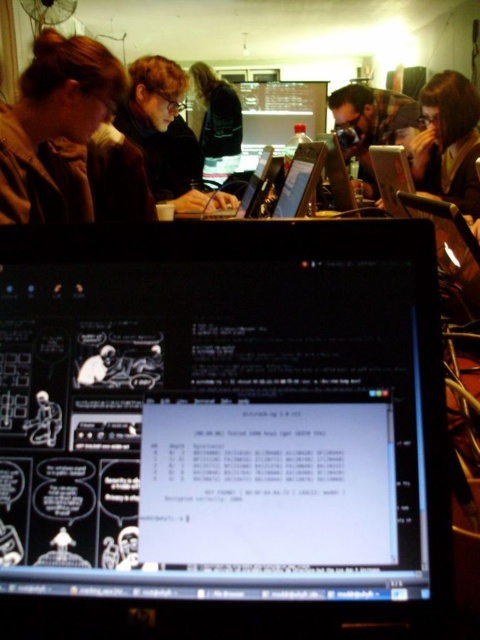
Which is behind, point (154, 125) or point (235, 204)?

The point (154, 125) is behind.

Who is more forward, (168,131) or (255,173)?

Point (255,173) is more forward.

I want to click on blonde hair at center, so click(167, 136).

Based on the photo, who is taller, black glossy monitor at center or matte black camera at center?

Standing taller between the two is matte black camera at center.

Can you confirm if black glossy monitor at center is positioned below matte black camera at center?

Yes.

Is point (36, 392) behind point (372, 129)?

No, it is in front of (372, 129).

You are a GUI agent. You are given a task and a screenshot of the screen. Output one action in this format:
    pyautogui.click(x=<x>, y=<y>)
    Task: Click on the black glossy monitor at center
    
    Given the screenshot: What is the action you would take?
    pyautogui.click(x=223, y=432)

Is the position of matte black camera at center less distant than that of matte black laptop at center?

No, matte black camera at center is further to the viewer.

Can you confirm if matte black camera at center is positioned below matte black laptop at center?

Actually, matte black camera at center is above matte black laptop at center.

Who is more forward, (373, 177) or (247, 202)?

Positioned in front is point (247, 202).

I want to click on matte black camera at center, so click(x=369, y=124).